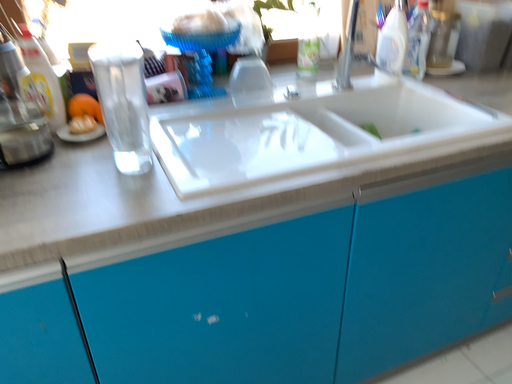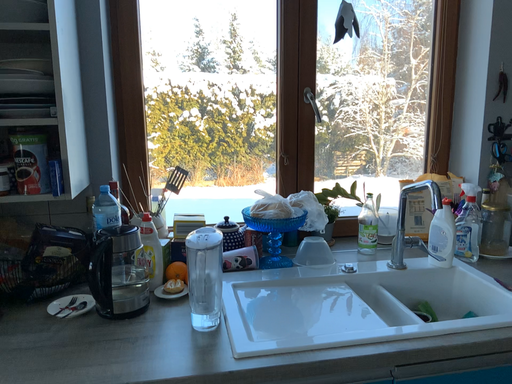
Question: Which way did the camera rotate in the video?

Choices:
 (A) rotated right
 (B) rotated left

Answer: (B)